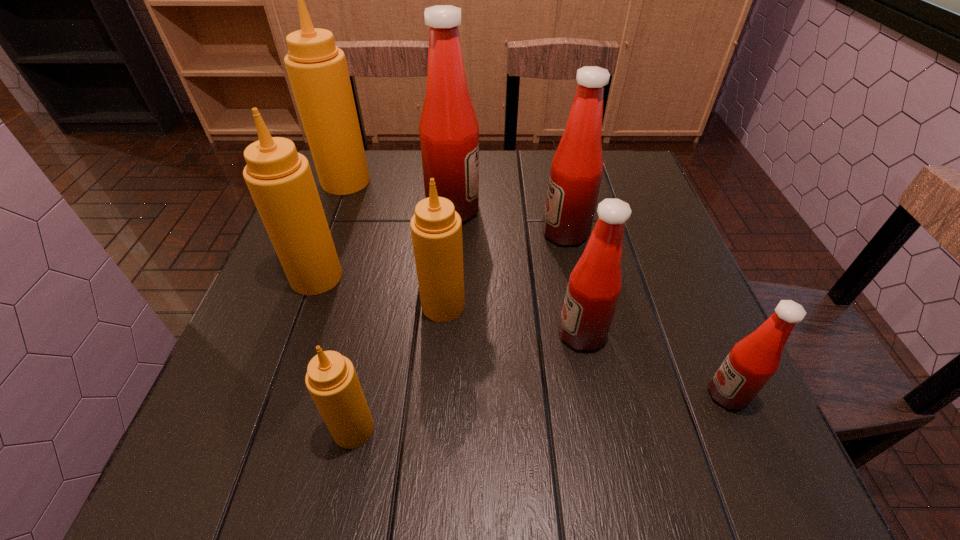
At what (x,y) coordinates should I click in order to perform the action: click on vacant space located on the left of the smallest tan condiment. Please return your answer as a coordinate pair (x, y). The height and width of the screenshot is (540, 960). Looking at the image, I should click on (283, 429).

Identify the location of free location located 0.350m on the front-facing side of the rightmost condiment. (503, 394).

Identify the location of vacant area situated on the front-facing side of the rightmost condiment. (503, 394).

Where is `free space located 0.250m on the front-facing side of the rightmost condiment`? This screenshot has width=960, height=540. free space located 0.250m on the front-facing side of the rightmost condiment is located at coordinates (562, 394).

This screenshot has width=960, height=540. Find the location of `object that is at the near edge`. object that is at the near edge is located at coordinates (331, 379).

Find the location of a particular element. Image resolution: width=960 pixels, height=540 pixels. object that is at the right edge is located at coordinates (752, 361).

Locate an element on the screen. Image resolution: width=960 pixels, height=540 pixels. object present at the far left corner is located at coordinates (317, 69).

The image size is (960, 540). I want to click on vacant space at the far edge, so click(x=548, y=159).

At what (x,y) coordinates should I click in order to perform the action: click on blank area at the near edge. Please return your answer as a coordinate pair (x, y). Image resolution: width=960 pixels, height=540 pixels. Looking at the image, I should click on (627, 479).

The height and width of the screenshot is (540, 960). I want to click on free space at the left edge of the desktop, so pos(344,275).